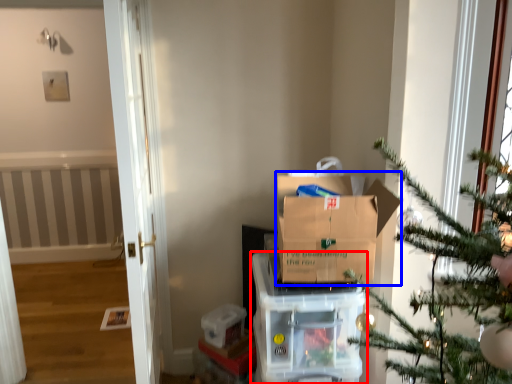
Question: Among these objects, which one is farthest to the camera, appliance (highlighted by a red box) or cardboard box (highlighted by a blue box)?

Choices:
 (A) appliance
 (B) cardboard box

Answer: (A)